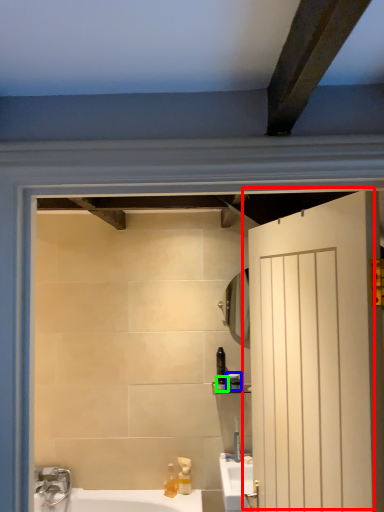
Question: Which object is positioned farthest from door (highlighted by a red box)? Select from toiletry (highlighted by a blue box) and toiletry (highlighted by a green box).

Choices:
 (A) toiletry
 (B) toiletry

Answer: (B)